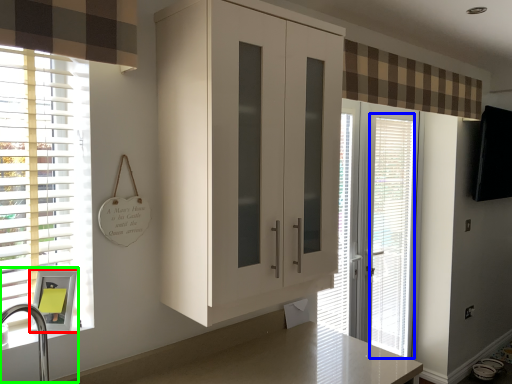
Question: Which object is the farthest from medicine cabinet (highlighted by a red box)? Choose among these: blind (highlighted by a blue box) or sink (highlighted by a green box).

Choices:
 (A) blind
 (B) sink

Answer: (A)